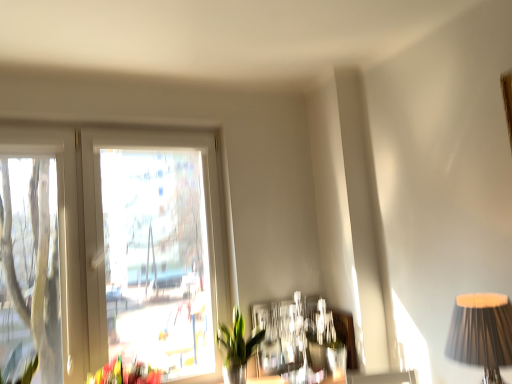
Question: Considering the positions of white plastic window at upper left and green leafy plant at left in the image, is white plastic window at upper left taller or shorter than green leafy plant at left?

Choices:
 (A) short
 (B) tall

Answer: (B)

Question: Considering the positions of white plastic window at upper left and green leafy plant at left in the image, is white plastic window at upper left wider or thinner than green leafy plant at left?

Choices:
 (A) wide
 (B) thin

Answer: (B)

Question: Estimate the real-world distances between objects in this image. Which object is closer to the black pleated fabric lampshade at right?

Choices:
 (A) white plastic window at upper left
 (B) green glossy plant at lower center
 (C) green leafy plant at left

Answer: (B)

Question: Estimate the real-world distances between objects in this image. Which object is farther from the black pleated fabric lampshade at right?

Choices:
 (A) green glossy plant at lower center
 (B) green leafy plant at left
 (C) white plastic window at upper left

Answer: (B)